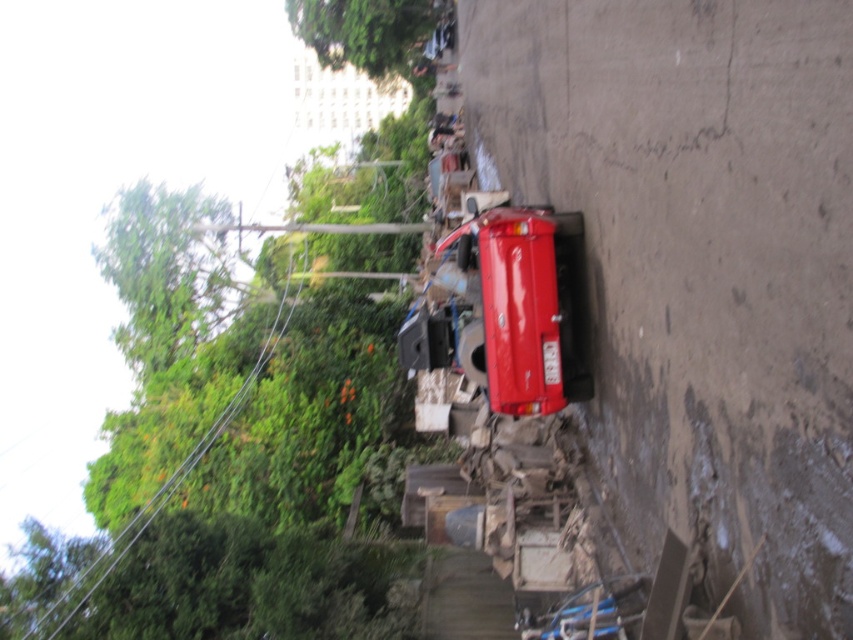
Between point (509, 372) and point (90, 570), which one is positioned in front?

Point (509, 372) is more forward.

What do you see at coordinates (521, 305) in the screenshot? I see `glossy red fire truck at center` at bounding box center [521, 305].

What do you see at coordinates (521, 305) in the screenshot? The image size is (853, 640). I see `glossy red fire truck at center` at bounding box center [521, 305].

The width and height of the screenshot is (853, 640). Find the location of `glossy red fire truck at center`. glossy red fire truck at center is located at coordinates (521, 305).